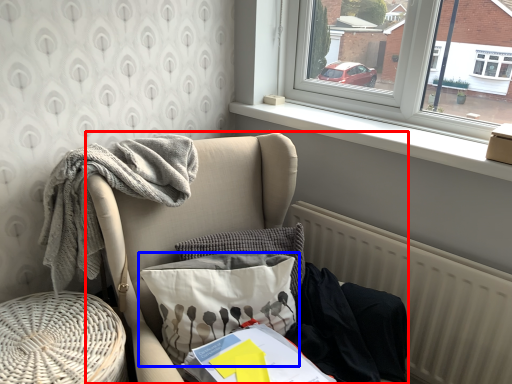
Question: Which object appears farthest to the camera in this image, furniture (highlighted by a red box) or pillow (highlighted by a blue box)?

Choices:
 (A) furniture
 (B) pillow

Answer: (B)